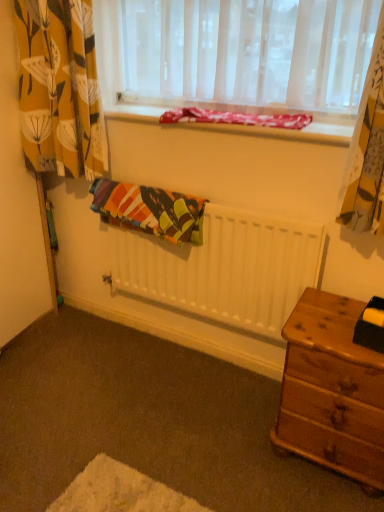
You are a GUI agent. You are given a task and a screenshot of the screen. Output one action in this format:
    pyautogui.click(x=<x>, y=<y>)
    Task: Click on the white matte radiator at center
    This screenshot has width=384, height=512.
    Given the screenshot: What is the action you would take?
    pyautogui.click(x=225, y=269)

I want to click on wooden nightstand at lower right, so click(x=332, y=390).

Based on the photo, is white matte radiator at center bigger than textured fabric at upper center?

Correct, white matte radiator at center is larger in size than textured fabric at upper center.

Based on the photo, between white matte radiator at center and textured fabric at upper center, which one appears on the left side from the viewer's perspective?

Positioned to the left is white matte radiator at center.

Is white matte radiator at center facing away from textured fabric at upper center?

No.

Looking at this image, is wooden nightstand at lower right oriented towards translucent fabric at upper center?

No, wooden nightstand at lower right is not facing towards translucent fabric at upper center.

Considering the sizes of objects wooden nightstand at lower right and translucent fabric at upper center in the image provided, who is thinner, wooden nightstand at lower right or translucent fabric at upper center?

translucent fabric at upper center is thinner.

Locate an element on the screen. This screenshot has height=512, width=384. window that appears above the wooden nightstand at lower right (from the image's perspective) is located at coordinates (237, 53).

From the image's perspective, between wooden nightstand at lower right and translucent fabric at upper center, who is located below?

wooden nightstand at lower right.

Considering their positions, is textured fabric at upper center located in front of or behind yellow floral fabric at left?

Clearly, textured fabric at upper center is in front of yellow floral fabric at left.

Between point (295, 134) and point (66, 64), which one is positioned behind?

Positioned behind is point (66, 64).

Would you say textured fabric at upper center is inside or outside yellow floral fabric at left?

textured fabric at upper center is not enclosed by yellow floral fabric at left.

Which point is more forward, (279, 240) or (182, 223)?

The point (279, 240) is closer to the camera.

Which is behind, white matte radiator at center or multicolored fabric at center?

multicolored fabric at center is further away from the camera.

From the image's perspective, who appears lower, white matte radiator at center or multicolored fabric at center?

white matte radiator at center, from the image's perspective.

Is wooden nightstand at lower right inside or outside of white matte radiator at center?

The correct answer is: outside.

Does point (315, 438) come in front of point (160, 256)?

Yes, it is in front of point (160, 256).

Is wooden nightstand at lower right aimed at white matte radiator at center?

No.

Consider the image. Is multicolored fabric at center at the right side of wooden nightstand at lower right?

In fact, multicolored fabric at center is to the left of wooden nightstand at lower right.

Can wooden nightstand at lower right be found inside multicolored fabric at center?

No.

Considering the positions of objects multicolored fabric at center and wooden nightstand at lower right in the image provided, who is in front, multicolored fabric at center or wooden nightstand at lower right?

wooden nightstand at lower right is more forward.

From a real-world perspective, is multicolored fabric at center positioned over wooden nightstand at lower right based on gravity?

Yes.

From a real-world perspective, who is located higher, textured fabric at upper center or white matte radiator at center?

From a 3D spatial view, textured fabric at upper center is above.

Is textured fabric at upper center taller than white matte radiator at center?

No.

From the image's perspective, between textured fabric at upper center and white matte radiator at center, who is located below?

white matte radiator at center appears lower in the image.

Considering the positions of objects textured fabric at upper center and white matte radiator at center in the image provided, who is behind, textured fabric at upper center or white matte radiator at center?

white matte radiator at center is further from the camera.

This screenshot has width=384, height=512. Identify the location of radiator that appears behind the textured fabric at upper center. (225, 269).

In the image, there is a translucent fabric at upper center. In order to click on nightstand below it (from the image's perspective) in this screenshot , I will do `click(332, 390)`.

When comparing their distances from wooden nightstand at lower right, does multicolored fabric at center or white matte radiator at center seem closer?

The object closer to wooden nightstand at lower right is white matte radiator at center.

Considering their positions, is wooden nightstand at lower right positioned closer to translucent fabric at upper center than white matte radiator at center?

white matte radiator at center is closer to translucent fabric at upper center.

Looking at the image, which one is located further to wooden nightstand at lower right, yellow floral fabric at left or multicolored fabric at center?

yellow floral fabric at left is further to wooden nightstand at lower right.

Which object lies further to the anchor point yellow floral fabric at left, white matte radiator at center or translucent fabric at upper center?

Based on the image, white matte radiator at center appears to be further to yellow floral fabric at left.

Consider the image. When comparing their distances from yellow floral fabric at left, does multicolored fabric at center or translucent fabric at upper center seem closer?

The object closer to yellow floral fabric at left is multicolored fabric at center.

Based on their spatial positions, is white matte radiator at center or textured fabric at upper center further from translucent fabric at upper center?

white matte radiator at center lies further to translucent fabric at upper center than the other object.

When comparing their distances from translucent fabric at upper center, does yellow floral fabric at left or white matte radiator at center seem closer?

yellow floral fabric at left is closer to translucent fabric at upper center.

Which object lies further to the anchor point textured fabric at upper center, wooden nightstand at lower right or yellow floral fabric at left?

wooden nightstand at lower right lies further to textured fabric at upper center than the other object.

This screenshot has width=384, height=512. I want to click on curtain between translucent fabric at upper center and wooden nightstand at lower right vertically, so click(60, 88).

The image size is (384, 512). Find the location of `blanket between yellow floral fabric at left and white matte radiator at center in the vertical direction`. blanket between yellow floral fabric at left and white matte radiator at center in the vertical direction is located at coordinates 149,210.

I want to click on window sill between translucent fabric at upper center and multicolored fabric at center in the up-down direction, so click(281, 131).

You are a GUI agent. You are given a task and a screenshot of the screen. Output one action in this format:
    pyautogui.click(x=<x>, y=<y>)
    Task: Click on the blanket between textured fabric at upper center and white matte radiator at center in the vertical direction
    
    Given the screenshot: What is the action you would take?
    pyautogui.click(x=149, y=210)